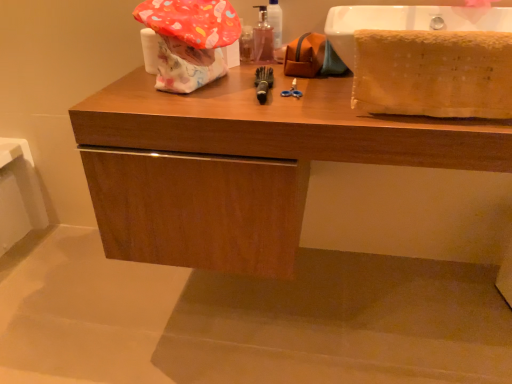
Where is `space that is in front of black rubber toothbrush at center`? space that is in front of black rubber toothbrush at center is located at coordinates (262, 112).